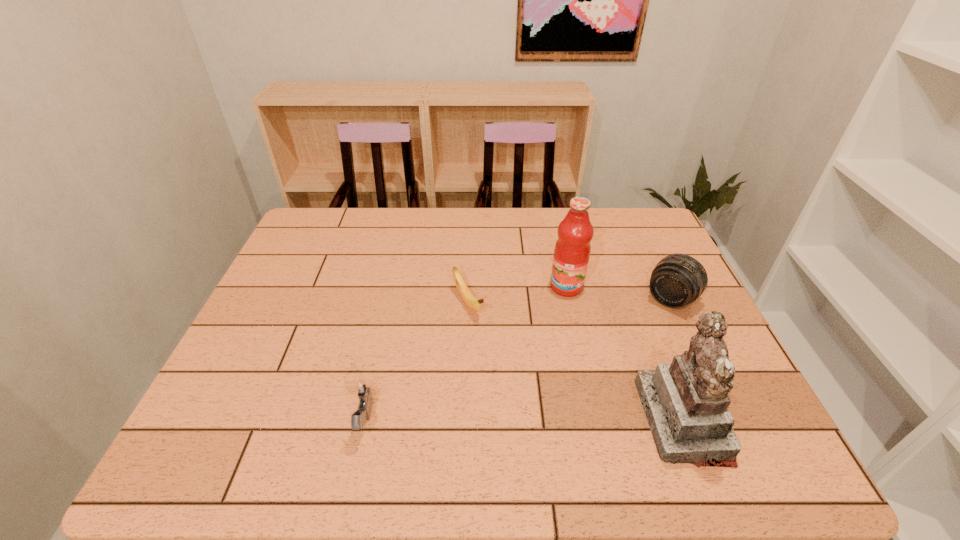
You are a GUI agent. You are given a task and a screenshot of the screen. Output one action in this format:
    pyautogui.click(x=<x>, y=<y>)
    Task: Click on the vacant spot on the desktop that is between the second shortest object and the figurine and is positioned at the front element of the telephoto lens
    Image resolution: width=960 pixels, height=540 pixels.
    Given the screenshot: What is the action you would take?
    pyautogui.click(x=571, y=421)

I want to click on free space on the desktop that is between the leftmost object and the figurine and is positioned at the stem of the shortest object, so click(551, 421).

I want to click on vacant spot on the desktop that is between the igniter and the figurine and is positioned on the front label of the fruit juice, so pos(519,421).